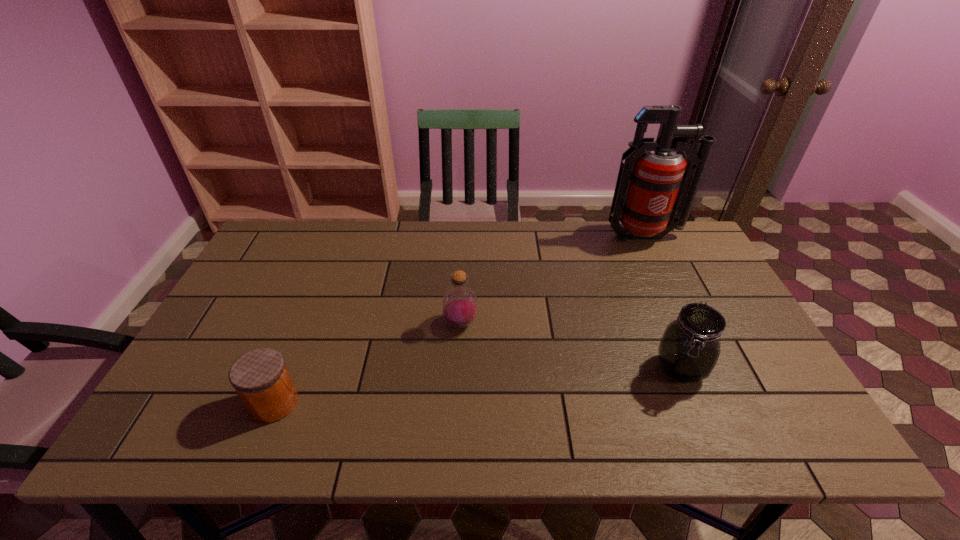
Find the location of a particular element. The height and width of the screenshot is (540, 960). vacant area located 0.180m on the left of the left jar is located at coordinates (172, 403).

Locate an element on the screen. Image resolution: width=960 pixels, height=540 pixels. object situated at the far edge is located at coordinates (655, 185).

Identify the location of object situated at the near edge. (260, 377).

The image size is (960, 540). I want to click on object that is at the right edge, so click(655, 185).

Find the location of a particular element. object at the far right corner is located at coordinates (655, 185).

Where is `free space at the far edge of the desktop`? This screenshot has height=540, width=960. free space at the far edge of the desktop is located at coordinates click(371, 233).

Locate an element on the screen. This screenshot has height=540, width=960. vacant space at the near edge of the desktop is located at coordinates (328, 414).

Image resolution: width=960 pixels, height=540 pixels. In order to click on free space at the left edge of the desktop in this screenshot , I will do `click(181, 400)`.

Locate an element on the screen. This screenshot has height=540, width=960. vacant space at the right edge of the desktop is located at coordinates (766, 400).

Find the location of `vacant space at the far left corner of the desktop`. vacant space at the far left corner of the desktop is located at coordinates (271, 239).